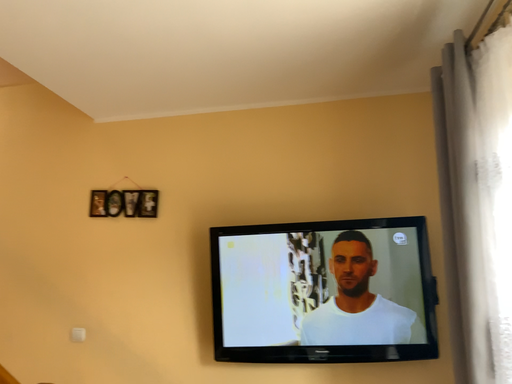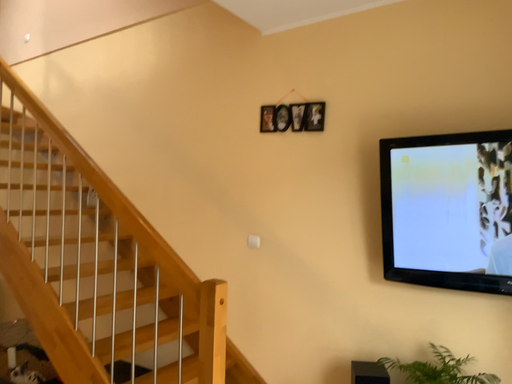
Question: How did the camera likely rotate when shooting the video?

Choices:
 (A) rotated left
 (B) rotated right

Answer: (A)